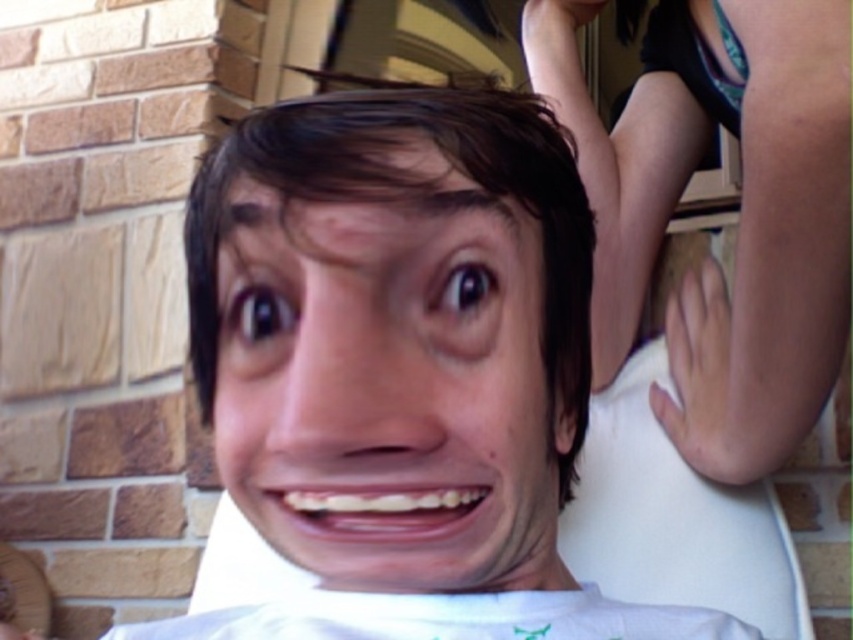
Does white matte shirt at center have a larger size compared to brown matte hair at center?

Yes.

How distant is white matte shirt at center from brown matte hair at center?

white matte shirt at center and brown matte hair at center are 2.55 centimeters apart.

Does point (454, 97) come closer to viewer compared to point (218, 221)?

No, (454, 97) is further to viewer.

Where is `white matte shirt at center`? Image resolution: width=853 pixels, height=640 pixels. white matte shirt at center is located at coordinates (402, 365).

Which is in front, point (224, 209) or point (787, 256)?

Point (224, 209) is more forward.

Can you confirm if brown matte hair at center is positioned below pale skin hand at upper right?

No.

You are a GUI agent. You are given a task and a screenshot of the screen. Output one action in this format:
    pyautogui.click(x=<x>, y=<y>)
    Task: Click on the brown matte hair at center
    
    Given the screenshot: What is the action you would take?
    pyautogui.click(x=410, y=204)

Does point (393, 620) come farther from viewer compared to point (741, 342)?

No.

Between white matte shirt at center and smooth skin hand at upper right, which one appears on the left side from the viewer's perspective?

white matte shirt at center

Does point (566, 189) come in front of point (753, 60)?

Yes, it is.

At what (x,y) coordinates should I click in order to perform the action: click on white matte shirt at center. Please return your answer as a coordinate pair (x, y). Looking at the image, I should click on (402, 365).